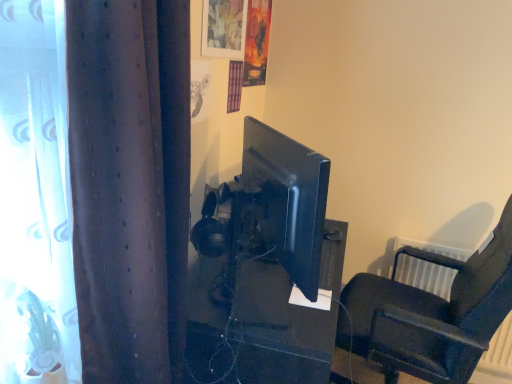
This screenshot has width=512, height=384. I want to click on brown textured curtain at left, so click(130, 185).

Identify the location of matte plastic picture frame at upper center. The height and width of the screenshot is (384, 512). click(224, 28).

Where is `brown textured curtain at left`? brown textured curtain at left is located at coordinates (130, 185).

Between matte plastic picture frame at upper center and black leather chair at right, which one appears on the right side from the viewer's perspective?

Positioned to the right is black leather chair at right.

Does point (207, 36) come in front of point (440, 303)?

Yes, point (207, 36) is in front of point (440, 303).

At what (x,y) coordinates should I click in order to perform the action: click on picture frame above the black leather chair at right (from the image's perspective). Please return your answer as a coordinate pair (x, y). Image resolution: width=512 pixels, height=384 pixels. Looking at the image, I should click on (224, 28).

Is matte plastic picture frame at upper center bigger than black leather chair at right?

Incorrect, matte plastic picture frame at upper center is not larger than black leather chair at right.

The height and width of the screenshot is (384, 512). I want to click on chair on the right of the brown textured curtain at left, so click(431, 314).

Which of these two, black leather chair at right or brown textured curtain at left, stands shorter?

With less height is brown textured curtain at left.

Which object is more forward, black leather chair at right or brown textured curtain at left?

brown textured curtain at left is in front.

Is black leather chair at right far from brown textured curtain at left?

No, black leather chair at right is in close proximity to brown textured curtain at left.

Which point is more distant from viewer, [264,349] or [240,29]?

The point [240,29] is farther.

Is satin black monitor at center positioned with its back to matte plastic picture frame at upper center?

No, matte plastic picture frame at upper center is not at the back of satin black monitor at center.

From the picture: Considering the relative sizes of satin black monitor at center and matte plastic picture frame at upper center in the image provided, is satin black monitor at center wider than matte plastic picture frame at upper center?

Correct, the width of satin black monitor at center exceeds that of matte plastic picture frame at upper center.

Could you tell me if satin black monitor at center is facing black leather chair at right?

Yes.

In the scene shown: Choose the correct answer: Is satin black monitor at center inside black leather chair at right or outside it?

satin black monitor at center is not enclosed by black leather chair at right.

In terms of size, does satin black monitor at center appear bigger or smaller than black leather chair at right?

In the image, satin black monitor at center appears to be smaller than black leather chair at right.

Are matte plastic picture frame at upper center and satin black monitor at center beside each other?

No, matte plastic picture frame at upper center is not touching satin black monitor at center.

Considering the relative positions of matte plastic picture frame at upper center and satin black monitor at center in the image provided, is matte plastic picture frame at upper center to the left of satin black monitor at center from the viewer's perspective?

Indeed, matte plastic picture frame at upper center is positioned on the left side of satin black monitor at center.

From their relative heights in the image, would you say matte plastic picture frame at upper center is taller or shorter than satin black monitor at center?

matte plastic picture frame at upper center is shorter than satin black monitor at center.

Which is correct: matte plastic picture frame at upper center is inside satin black monitor at center, or outside of it?

matte plastic picture frame at upper center is outside satin black monitor at center.

Is brown textured curtain at left at the back of satin black monitor at center?

That's not correct — satin black monitor at center is not looking away from brown textured curtain at left.

How different are the orientations of satin black monitor at center and brown textured curtain at left in degrees?

There is a 2.94-degree angle between the facing directions of satin black monitor at center and brown textured curtain at left.

From the image's perspective, relative to brown textured curtain at left, is satin black monitor at center above or below?

Clearly, from the image's perspective, satin black monitor at center is below brown textured curtain at left.

The width and height of the screenshot is (512, 384). Identify the location of curtain lying on the left of matte plastic picture frame at upper center. (130, 185).

Which is in front, matte plastic picture frame at upper center or brown textured curtain at left?

brown textured curtain at left is in front.

Can you confirm if matte plastic picture frame at upper center is taller than brown textured curtain at left?

Incorrect, the height of matte plastic picture frame at upper center is not larger of that of brown textured curtain at left.

Which object is wider, matte plastic picture frame at upper center or brown textured curtain at left?

brown textured curtain at left.

Locate an element on the screen. The width and height of the screenshot is (512, 384). chair in front of the matte plastic picture frame at upper center is located at coordinates (431, 314).

At what (x,y) coordinates should I click in order to perform the action: click on chair below the brown textured curtain at left (from a real-world perspective). Please return your answer as a coordinate pair (x, y). This screenshot has width=512, height=384. Looking at the image, I should click on (431, 314).

When comparing their distances from satin black monitor at center, does matte plastic picture frame at upper center or brown textured curtain at left seem closer?

The object closer to satin black monitor at center is brown textured curtain at left.

Estimate the real-world distances between objects in this image. Which object is closer to matte plastic picture frame at upper center, satin black monitor at center or brown textured curtain at left?

brown textured curtain at left lies closer to matte plastic picture frame at upper center than the other object.

Based on their spatial positions, is satin black monitor at center or black leather chair at right further from matte plastic picture frame at upper center?

black leather chair at right is further to matte plastic picture frame at upper center.

From the image, which object appears to be nearer to matte plastic picture frame at upper center, brown textured curtain at left or black leather chair at right?

brown textured curtain at left is positioned closer to the anchor matte plastic picture frame at upper center.

Looking at the image, which one is located further to black leather chair at right, matte plastic picture frame at upper center or brown textured curtain at left?

matte plastic picture frame at upper center lies further to black leather chair at right than the other object.

When comparing their distances from brown textured curtain at left, does black leather chair at right or matte plastic picture frame at upper center seem closer?

Among the two, matte plastic picture frame at upper center is located nearer to brown textured curtain at left.

From the image, which object appears to be farther from black leather chair at right, satin black monitor at center or matte plastic picture frame at upper center?

matte plastic picture frame at upper center lies further to black leather chair at right than the other object.

Looking at the image, which one is located further to brown textured curtain at left, satin black monitor at center or black leather chair at right?

The object further to brown textured curtain at left is black leather chair at right.

Identify the location of curtain between matte plastic picture frame at upper center and satin black monitor at center in the vertical direction. (130, 185).

Image resolution: width=512 pixels, height=384 pixels. Identify the location of curtain between matte plastic picture frame at upper center and black leather chair at right in the up-down direction. click(130, 185).

The image size is (512, 384). I want to click on chair between matte plastic picture frame at upper center and satin black monitor at center vertically, so click(431, 314).

This screenshot has height=384, width=512. What are the coordinates of `furniture between brown textured curtain at left and black leather chair at right from left to right` in the screenshot? It's located at (263, 321).